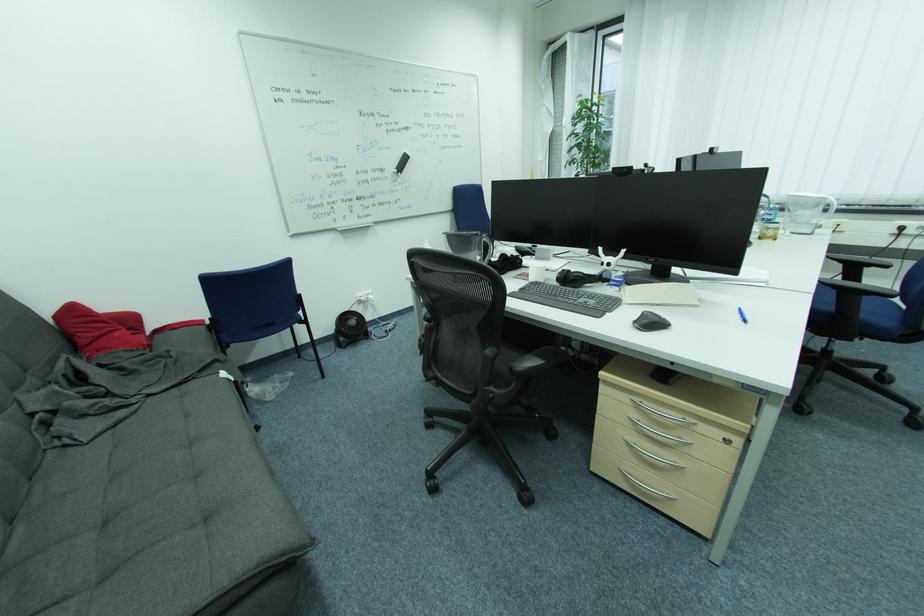
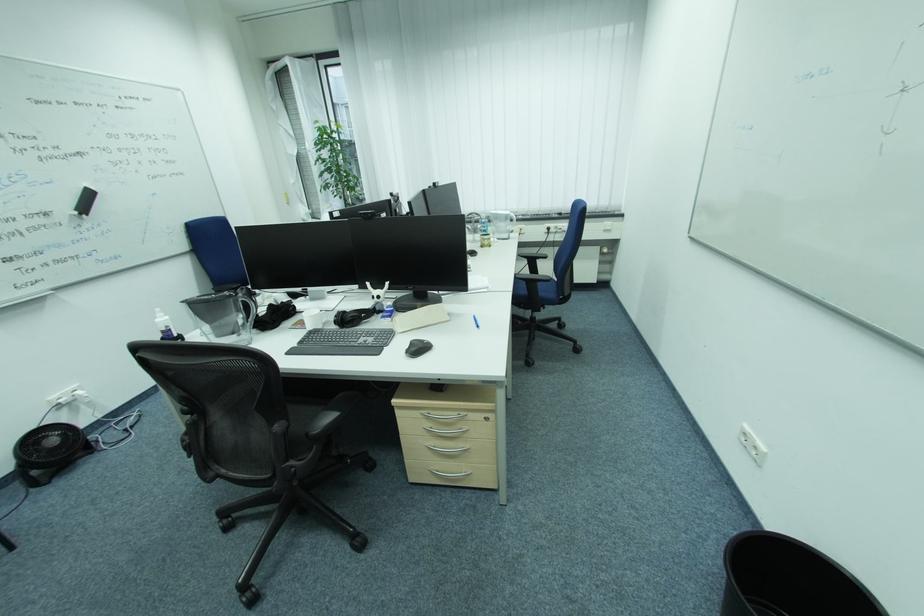
Locate, in the second image, the point that corresponds to [489,236] in the first image.

(242, 294)